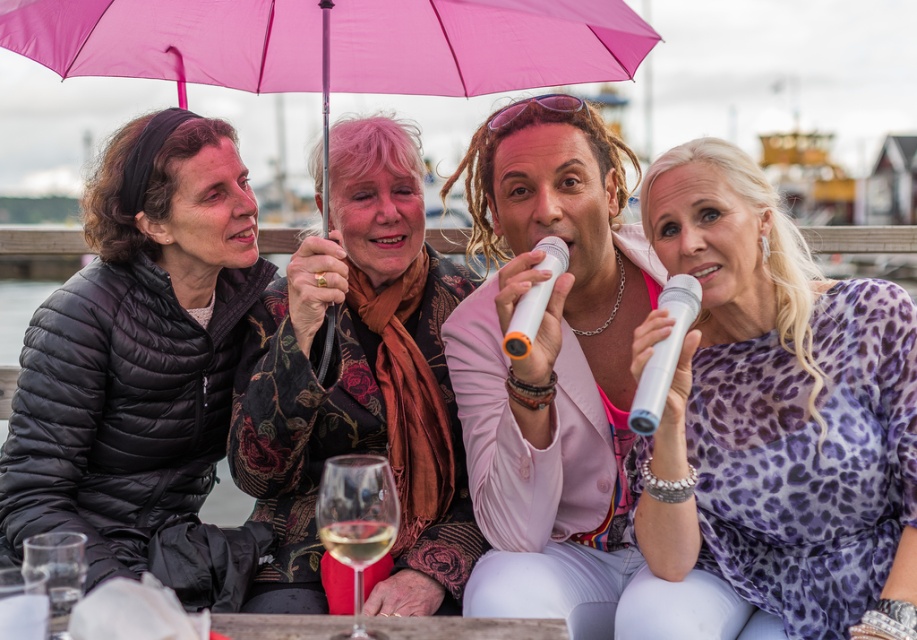
Question: Among these points, which one is nearest to the camera?

Choices:
 (A) (326, 529)
 (B) (327, 483)

Answer: (B)

Question: Is purple leopard print dress at center to the left of floral-patterned scarf at center from the viewer's perspective?

Choices:
 (A) yes
 (B) no

Answer: (B)

Question: Does pink fabric umbrella at upper center appear on the left side of translucent glass at lower center?

Choices:
 (A) no
 (B) yes

Answer: (B)

Question: Which object is the farthest from the translucent glass at lower center?

Choices:
 (A) black quilted jacket at left
 (B) floral-patterned scarf at center
 (C) clear glass wine glass at lower center
 (D) leopard print dress at center

Answer: (A)

Question: Which is nearer to the purple leopard print dress at center?

Choices:
 (A) translucent glass at lower center
 (B) floral-patterned scarf at center
 (C) pink fabric umbrella at upper center

Answer: (C)

Question: Does pink fabric umbrella at upper center appear on the left side of translucent glass at lower center?

Choices:
 (A) no
 (B) yes

Answer: (B)